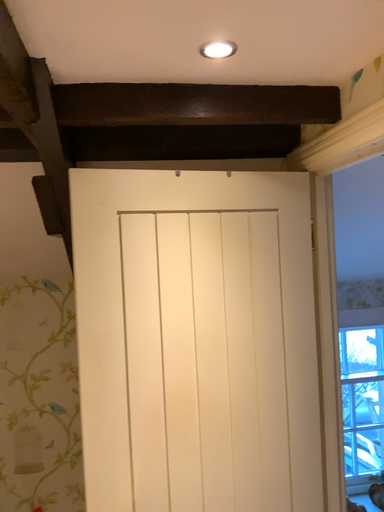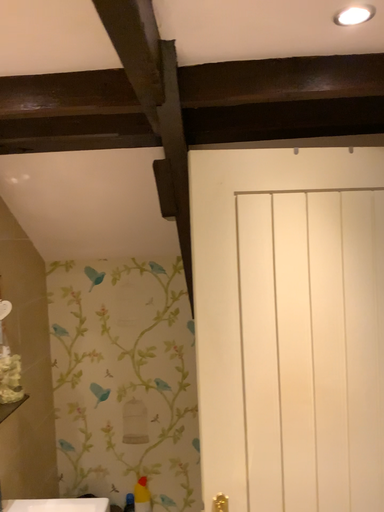
Question: How did the camera likely rotate when shooting the video?

Choices:
 (A) rotated right
 (B) rotated left

Answer: (B)